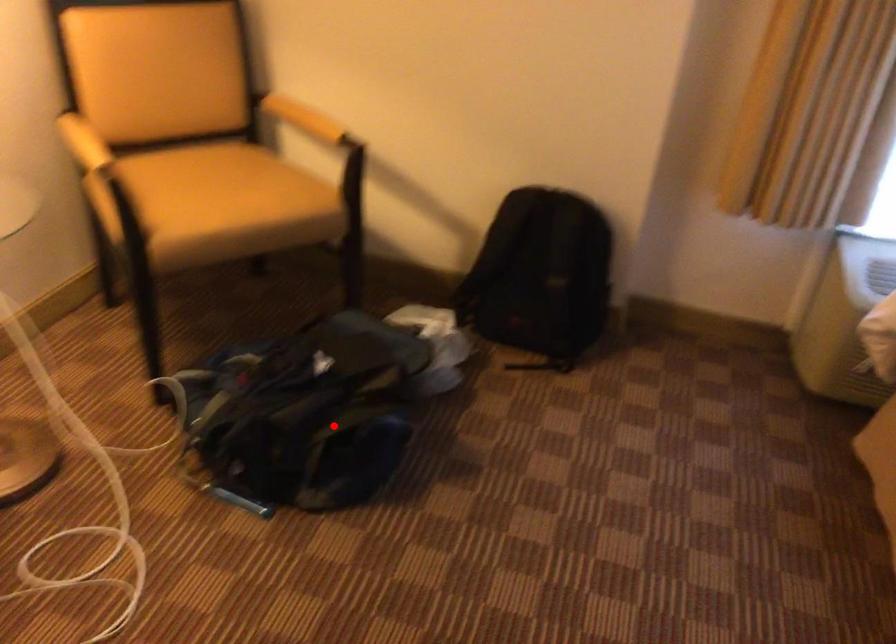
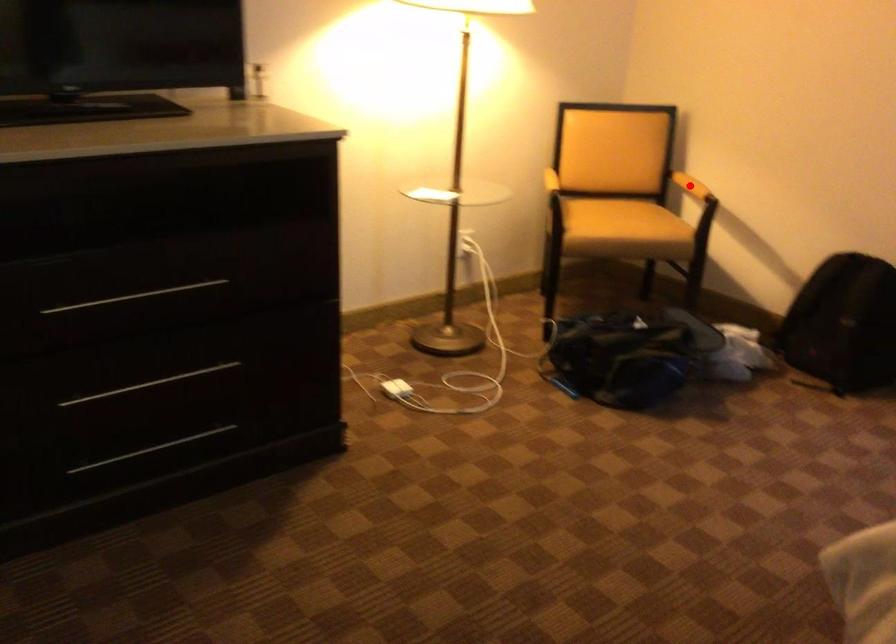
I am providing you with two images of the same scene from different viewpoints. A red point is marked on the first image and another point is marked on the second image. Do the highlighted points in image1 and image2 indicate the same real-world spot?

No